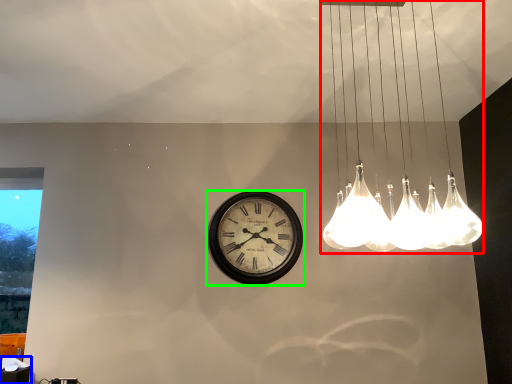
Question: Which is nearer to the lamp (highlighted by a red box)? table (highlighted by a blue box) or wall clock (highlighted by a green box).

Choices:
 (A) table
 (B) wall clock

Answer: (B)